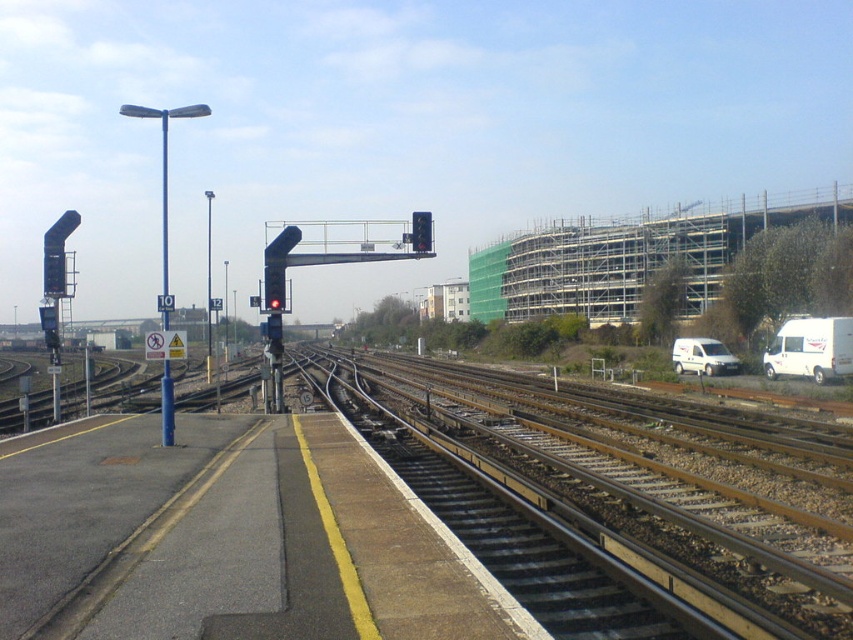
Between blue metallic pole at center and metallic traffic light at center, which one appears on the right side from the viewer's perspective?

metallic traffic light at center

This screenshot has width=853, height=640. What do you see at coordinates (164, 198) in the screenshot?
I see `blue metallic pole at center` at bounding box center [164, 198].

Is point (160, 406) behind point (422, 225)?

Yes, point (160, 406) is farther from viewer.

This screenshot has width=853, height=640. In order to click on blue metallic pole at center in this screenshot , I will do `click(164, 198)`.

Can you confirm if blue metallic pole at center is positioned to the right of black plastic traffic light at left?

Indeed, blue metallic pole at center is positioned on the right side of black plastic traffic light at left.

Who is positioned more to the left, blue metallic pole at center or black plastic traffic light at left?

From the viewer's perspective, black plastic traffic light at left appears more on the left side.

Looking at this image, who is more distant from viewer, (166,314) or (56,289)?

Point (56,289)

Identify the location of blue metallic pole at center. The image size is (853, 640). (164, 198).

Does point (55, 237) come behind point (428, 248)?

No, it is not.

Can you confirm if black plastic traffic light at left is positioned to the right of metallic traffic light at center?

No, black plastic traffic light at left is not to the right of metallic traffic light at center.

Locate an element on the screen. This screenshot has height=640, width=853. black plastic traffic light at left is located at coordinates (57, 253).